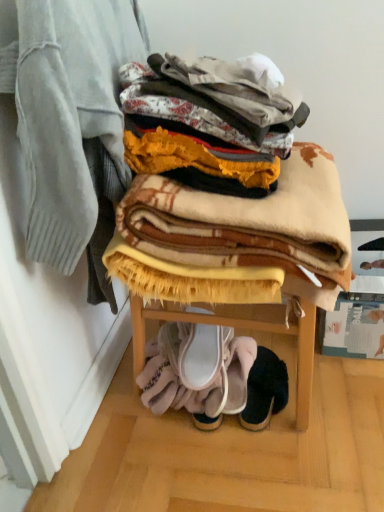
This screenshot has width=384, height=512. What are the coordinates of `plaid wool blanket at upper center, which is counted as the second blanket, starting from the right` in the screenshot? It's located at (71, 115).

Locate an element on the screen. white fabric slipper at lower center, the first footwear from the left is located at coordinates (200, 356).

Does white fabric slipper at lower center, positioned as the third footwear in right-to-left order, have a larger size compared to plaid wool blanket at upper center, arranged as the first blanket when viewed from the left?

Incorrect, white fabric slipper at lower center, positioned as the third footwear in right-to-left order, is not larger than plaid wool blanket at upper center, arranged as the first blanket when viewed from the left.

Is white fabric slipper at lower center, the first footwear from the left, taller or shorter than plaid wool blanket at upper center, which is counted as the second blanket, starting from the right?

white fabric slipper at lower center, the first footwear from the left, is shorter than plaid wool blanket at upper center, which is counted as the second blanket, starting from the right.

In the scene shown: Considering the positions of objects white fabric slipper at lower center, the first footwear from the left, and plaid wool blanket at upper center, arranged as the first blanket when viewed from the left, in the image provided, who is more to the left, white fabric slipper at lower center, the first footwear from the left, or plaid wool blanket at upper center, arranged as the first blanket when viewed from the left,?

Positioned to the left is plaid wool blanket at upper center, arranged as the first blanket when viewed from the left.

Is white fabric slipper at lower center, the first footwear from the left, placed right next to plaid wool blanket at upper center, arranged as the first blanket when viewed from the left?

They are not placed beside each other.

Does white fabric slipper at lower center, acting as the second footwear starting from the left, have a smaller size compared to white fabric slipper at lower center, positioned as the third footwear in right-to-left order?

Actually, white fabric slipper at lower center, acting as the second footwear starting from the left, might be larger than white fabric slipper at lower center, positioned as the third footwear in right-to-left order.

Is white fabric slipper at lower center, acting as the second footwear starting from the left, completely or partially outside of white fabric slipper at lower center, positioned as the third footwear in right-to-left order?

white fabric slipper at lower center, acting as the second footwear starting from the left, is positioned outside white fabric slipper at lower center, positioned as the third footwear in right-to-left order.

How different are the orientations of white fabric slipper at lower center, the 2th footwear positioned from the right, and white fabric slipper at lower center, the first footwear from the left, in degrees?

They differ by 0.58 degrees in their facing directions.

Which point is more distant from viewer, (335, 266) or (216, 327)?

The point (216, 327) is farther.

From the image's perspective, which is above, beige woolen blanket at center, the first blanket in the right-to-left sequence, or white fabric slipper at lower center, the first footwear from the left?

beige woolen blanket at center, the first blanket in the right-to-left sequence, is shown above in the image.

How different are the orientations of beige woolen blanket at center, the first blanket in the right-to-left sequence, and white fabric slipper at lower center, positioned as the third footwear in right-to-left order, in degrees?

The facing directions of beige woolen blanket at center, the first blanket in the right-to-left sequence, and white fabric slipper at lower center, positioned as the third footwear in right-to-left order, are 88.6 degrees apart.

From a real-world perspective, is beige woolen blanket at center, the first blanket in the right-to-left sequence, physically above white fabric slipper at lower center, positioned as the third footwear in right-to-left order?

Indeed, from a real-world perspective, beige woolen blanket at center, the first blanket in the right-to-left sequence, stands above white fabric slipper at lower center, positioned as the third footwear in right-to-left order.

Can you confirm if white fabric slipper at lower center, the 2th footwear positioned from the right, is taller than plaid wool blanket at upper center, which is counted as the second blanket, starting from the right?

Incorrect, the height of white fabric slipper at lower center, the 2th footwear positioned from the right, is not larger of that of plaid wool blanket at upper center, which is counted as the second blanket, starting from the right.

In the image, is white fabric slipper at lower center, the 2th footwear positioned from the right, on the left side or the right side of plaid wool blanket at upper center, arranged as the first blanket when viewed from the left?

In the image, white fabric slipper at lower center, the 2th footwear positioned from the right, appears on the right side of plaid wool blanket at upper center, arranged as the first blanket when viewed from the left.

Is white fabric slipper at lower center, the 2th footwear positioned from the right, in contact with plaid wool blanket at upper center, which is counted as the second blanket, starting from the right?

They are not placed beside each other.

From the image's perspective, would you say white fabric slipper at lower center, the 2th footwear positioned from the right, is positioned over plaid wool blanket at upper center, which is counted as the second blanket, starting from the right?

Incorrect, from the image's perspective, white fabric slipper at lower center, the 2th footwear positioned from the right, is lower than plaid wool blanket at upper center, which is counted as the second blanket, starting from the right.

Is there a large distance between black suede slipper at lower center, marked as the 1th footwear in a right-to-left arrangement, and plaid wool blanket at upper center, arranged as the first blanket when viewed from the left?

That's not correct — black suede slipper at lower center, marked as the 1th footwear in a right-to-left arrangement, is a little close to plaid wool blanket at upper center, arranged as the first blanket when viewed from the left.

Does black suede slipper at lower center, the 3th footwear positioned from the left, appear on the right side of plaid wool blanket at upper center, arranged as the first blanket when viewed from the left?

Correct, you'll find black suede slipper at lower center, the 3th footwear positioned from the left, to the right of plaid wool blanket at upper center, arranged as the first blanket when viewed from the left.

Looking at their sizes, would you say black suede slipper at lower center, marked as the 1th footwear in a right-to-left arrangement, is wider or thinner than plaid wool blanket at upper center, which is counted as the second blanket, starting from the right?

In the image, black suede slipper at lower center, marked as the 1th footwear in a right-to-left arrangement, appears to be wider than plaid wool blanket at upper center, which is counted as the second blanket, starting from the right.

From the picture: Is black suede slipper at lower center, the 3th footwear positioned from the left, spatially inside plaid wool blanket at upper center, arranged as the first blanket when viewed from the left, or outside of it?

The correct answer is: outside.

From a real-world perspective, is black suede slipper at lower center, the 3th footwear positioned from the left, positioned over beige woolen blanket at center, which appears as the 2th blanket when viewed from the left, based on gravity?

Actually, black suede slipper at lower center, the 3th footwear positioned from the left, is physically below beige woolen blanket at center, which appears as the 2th blanket when viewed from the left, in the real world.

Does black suede slipper at lower center, the 3th footwear positioned from the left, have a larger size compared to beige woolen blanket at center, the first blanket in the right-to-left sequence?

Incorrect, black suede slipper at lower center, the 3th footwear positioned from the left, is not larger than beige woolen blanket at center, the first blanket in the right-to-left sequence.

Which is more to the right, black suede slipper at lower center, the 3th footwear positioned from the left, or beige woolen blanket at center, the first blanket in the right-to-left sequence?

black suede slipper at lower center, the 3th footwear positioned from the left.

Which footwear is the 2nd one when counting from the right side of the beige woolen blanket at center, which appears as the 2th blanket when viewed from the left? Please provide its 2D coordinates.

[(265, 390)]

Looking at their sizes, would you say black suede slipper at lower center, the 3th footwear positioned from the left, is wider or thinner than white fabric slipper at lower center, the first footwear from the left?

black suede slipper at lower center, the 3th footwear positioned from the left, is thinner than white fabric slipper at lower center, the first footwear from the left.

Where is `the 2nd footwear to the left of the black suede slipper at lower center, marked as the 1th footwear in a right-to-left arrangement, starting your count from the anchor`? The image size is (384, 512). the 2nd footwear to the left of the black suede slipper at lower center, marked as the 1th footwear in a right-to-left arrangement, starting your count from the anchor is located at coordinates (200, 356).

Is black suede slipper at lower center, marked as the 1th footwear in a right-to-left arrangement, completely or partially outside of white fabric slipper at lower center, the first footwear from the left?

Yes, black suede slipper at lower center, marked as the 1th footwear in a right-to-left arrangement, is not within white fabric slipper at lower center, the first footwear from the left.

Is black suede slipper at lower center, marked as the 1th footwear in a right-to-left arrangement, far from white fabric slipper at lower center, positioned as the third footwear in right-to-left order?

They are positioned close to each other.

Which footwear is the 1st one when counting from the back of the plaid wool blanket at upper center, which is counted as the second blanket, starting from the right? Please provide its 2D coordinates.

[(200, 356)]

In order to click on footwear that is in front of the white fabric slipper at lower center, the 2th footwear positioned from the right in this screenshot , I will do `click(200, 356)`.

Considering their positions, is white fabric slipper at lower center, acting as the second footwear starting from the left, positioned further to white fabric slipper at lower center, the first footwear from the left, than plaid wool blanket at upper center, which is counted as the second blanket, starting from the right?

The object further to white fabric slipper at lower center, the first footwear from the left, is plaid wool blanket at upper center, which is counted as the second blanket, starting from the right.

Considering their positions, is white fabric slipper at lower center, the 2th footwear positioned from the right, positioned further to black suede slipper at lower center, marked as the 1th footwear in a right-to-left arrangement, than beige woolen blanket at center, which appears as the 2th blanket when viewed from the left?

beige woolen blanket at center, which appears as the 2th blanket when viewed from the left, is positioned further to the anchor black suede slipper at lower center, marked as the 1th footwear in a right-to-left arrangement.

Considering their positions, is plaid wool blanket at upper center, which is counted as the second blanket, starting from the right, positioned closer to beige woolen blanket at center, the first blanket in the right-to-left sequence, than black suede slipper at lower center, the 3th footwear positioned from the left?

plaid wool blanket at upper center, which is counted as the second blanket, starting from the right, lies closer to beige woolen blanket at center, the first blanket in the right-to-left sequence, than the other object.

From the image, which object appears to be nearer to plaid wool blanket at upper center, which is counted as the second blanket, starting from the right, white fabric slipper at lower center, positioned as the third footwear in right-to-left order, or beige woolen blanket at center, the first blanket in the right-to-left sequence?

Among the two, beige woolen blanket at center, the first blanket in the right-to-left sequence, is located nearer to plaid wool blanket at upper center, which is counted as the second blanket, starting from the right.

Looking at the image, which one is located further to white fabric slipper at lower center, acting as the second footwear starting from the left, black suede slipper at lower center, the 3th footwear positioned from the left, or beige woolen blanket at center, the first blanket in the right-to-left sequence?

beige woolen blanket at center, the first blanket in the right-to-left sequence, lies further to white fabric slipper at lower center, acting as the second footwear starting from the left, than the other object.

When comparing their distances from black suede slipper at lower center, the 3th footwear positioned from the left, does plaid wool blanket at upper center, arranged as the first blanket when viewed from the left, or beige woolen blanket at center, the first blanket in the right-to-left sequence, seem further?

Based on the image, plaid wool blanket at upper center, arranged as the first blanket when viewed from the left, appears to be further to black suede slipper at lower center, the 3th footwear positioned from the left.

Considering their positions, is beige woolen blanket at center, the first blanket in the right-to-left sequence, positioned closer to black suede slipper at lower center, the 3th footwear positioned from the left, than white fabric slipper at lower center, acting as the second footwear starting from the left?

white fabric slipper at lower center, acting as the second footwear starting from the left, is positioned closer to the anchor black suede slipper at lower center, the 3th footwear positioned from the left.

From the image, which object appears to be farther from plaid wool blanket at upper center, arranged as the first blanket when viewed from the left, beige woolen blanket at center, the first blanket in the right-to-left sequence, or black suede slipper at lower center, marked as the 1th footwear in a right-to-left arrangement?

The object further to plaid wool blanket at upper center, arranged as the first blanket when viewed from the left, is black suede slipper at lower center, marked as the 1th footwear in a right-to-left arrangement.

Find the location of `footwear situated between white fabric slipper at lower center, the first footwear from the left, and black suede slipper at lower center, the 3th footwear positioned from the left, from left to right`. footwear situated between white fabric slipper at lower center, the first footwear from the left, and black suede slipper at lower center, the 3th footwear positioned from the left, from left to right is located at coordinates (239, 373).

You are a GUI agent. You are given a task and a screenshot of the screen. Output one action in this format:
    pyautogui.click(x=<x>, y=<y>)
    Task: Click on the blanket between plaid wool blanket at upper center, which is counted as the second blanket, starting from the right, and black suede slipper at lower center, marked as the 1th footwear in a right-to-left arrangement, in the vertical direction
    
    Given the screenshot: What is the action you would take?
    pyautogui.click(x=250, y=225)

Image resolution: width=384 pixels, height=512 pixels. In order to click on blanket between plaid wool blanket at upper center, which is counted as the second blanket, starting from the right, and white fabric slipper at lower center, acting as the second footwear starting from the left, vertically in this screenshot , I will do coord(250,225).

Identify the location of footwear between beige woolen blanket at center, the first blanket in the right-to-left sequence, and white fabric slipper at lower center, the 2th footwear positioned from the right, from top to bottom. (200, 356).